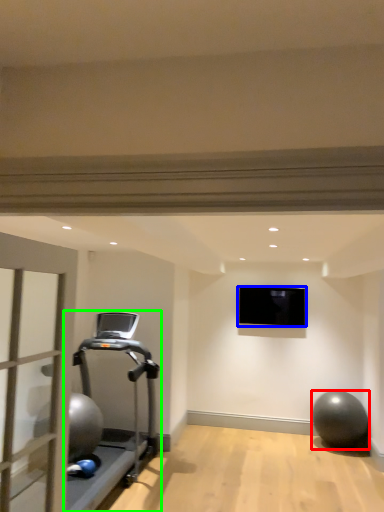
Question: Which is farther away from ball (highlighted by a red box)? projection screen (highlighted by a blue box) or treadmill (highlighted by a green box)?

Choices:
 (A) projection screen
 (B) treadmill

Answer: (B)